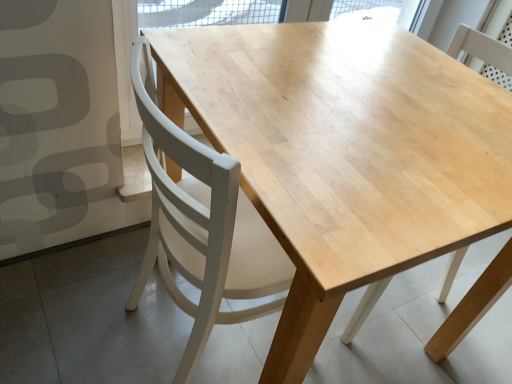
Question: In the image, is light wood chair at center, which ranks as the 2th chair in left-to-right order, positioned in front of or behind white wood chair at center, arranged as the first chair when viewed from the left?

Choices:
 (A) behind
 (B) front

Answer: (A)

Question: From the image's perspective, is light wood chair at center, which ranks as the 2th chair in left-to-right order, positioned above or below white wood chair at center, arranged as the first chair when viewed from the left?

Choices:
 (A) below
 (B) above

Answer: (B)

Question: Based on their sizes in the image, would you say light wood chair at center, which ranks as the 2th chair in left-to-right order, is bigger or smaller than white wood chair at center, arranged as the first chair when viewed from the left?

Choices:
 (A) big
 (B) small

Answer: (B)

Question: Is white wood chair at center, arranged as the first chair when viewed from the left, bigger or smaller than light wood chair at center, marked as the 1th chair in a right-to-left arrangement?

Choices:
 (A) small
 (B) big

Answer: (B)

Question: From the image's perspective, is white wood chair at center, positioned as the 2th chair in right-to-left order, positioned above or below light wood chair at center, which ranks as the 2th chair in left-to-right order?

Choices:
 (A) below
 (B) above

Answer: (A)

Question: Choose the correct answer: Is white wood chair at center, positioned as the 2th chair in right-to-left order, inside light wood chair at center, which ranks as the 2th chair in left-to-right order, or outside it?

Choices:
 (A) inside
 (B) outside

Answer: (B)

Question: Relative to light wood chair at center, marked as the 1th chair in a right-to-left arrangement, is white wood chair at center, arranged as the first chair when viewed from the left, in front or behind?

Choices:
 (A) behind
 (B) front

Answer: (B)